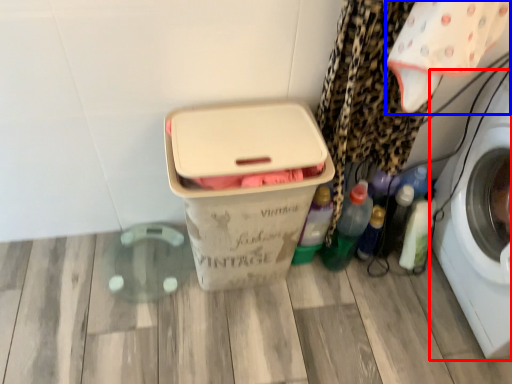
Question: Which point is closer to the camera, washing machine (highlighted by a red box) or baby clothe (highlighted by a blue box)?

Choices:
 (A) washing machine
 (B) baby clothe

Answer: (A)